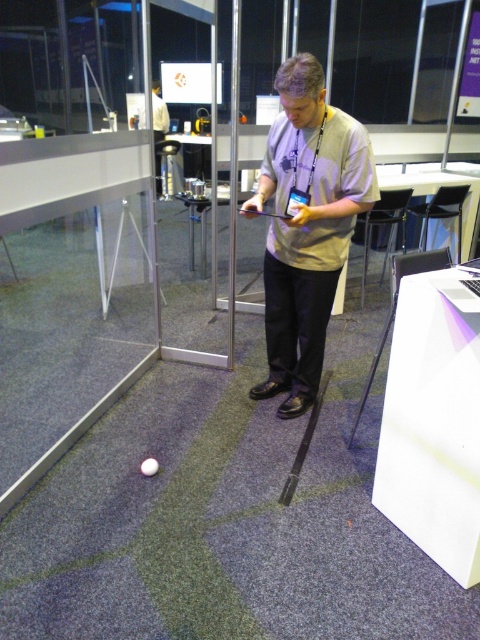
Question: Which object appears farthest from the camera in this image?

Choices:
 (A) transparent glass door at center
 (B) white matte ball at lower center

Answer: (A)

Question: In this image, where is light gray cotton shirt at center located relative to white matte ball at lower center?

Choices:
 (A) left
 (B) right

Answer: (B)

Question: Can you confirm if light gray cotton shirt at center is smaller than white matte ball at lower center?

Choices:
 (A) no
 (B) yes

Answer: (A)

Question: Can you confirm if light gray cotton shirt at center is wider than white matte ball at lower center?

Choices:
 (A) yes
 (B) no

Answer: (A)

Question: Which of the following is the farthest from the observer?

Choices:
 (A) white matte ball at lower center
 (B) transparent glass door at center

Answer: (B)

Question: Among these points, which one is nearest to the camera?

Choices:
 (A) (230, 355)
 (B) (309, 112)
 (C) (152, 468)

Answer: (B)